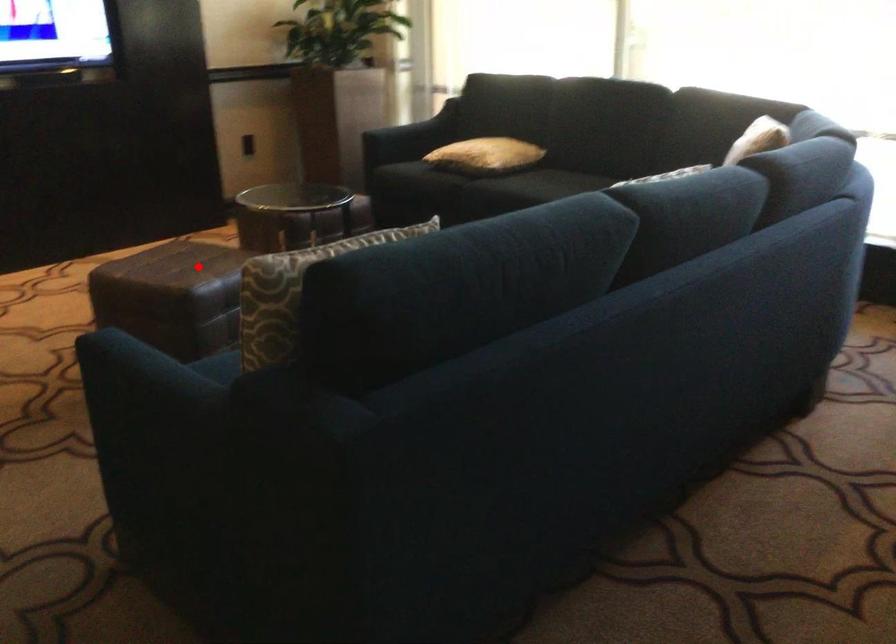
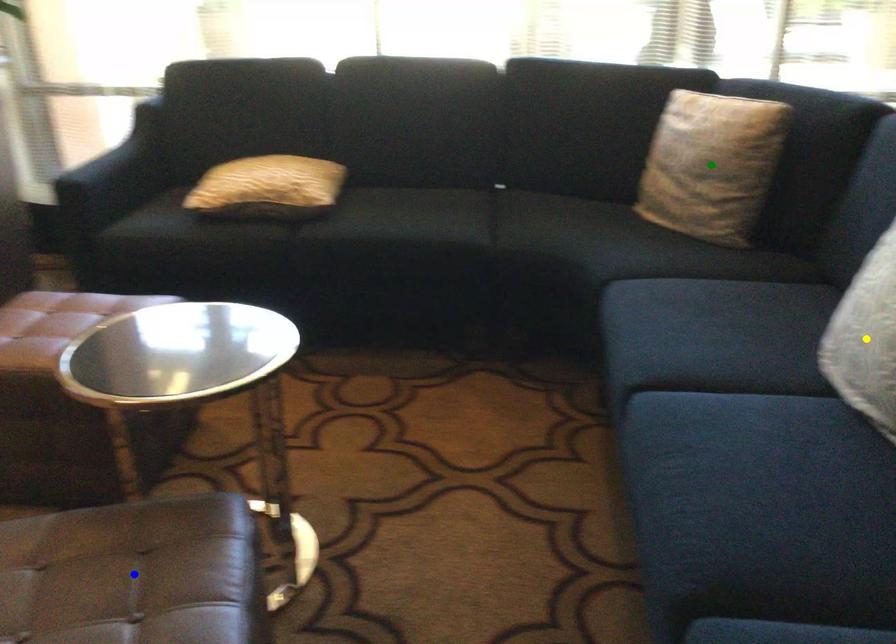
Question: I am providing you with two images of the same scene from different viewpoints. A red point is marked on the first image. You are given multiple points on the second image. In image 2, which mark is for the same physical point as the one in image 1?

Choices:
 (A) blue point
 (B) green point
 (C) yellow point

Answer: (A)